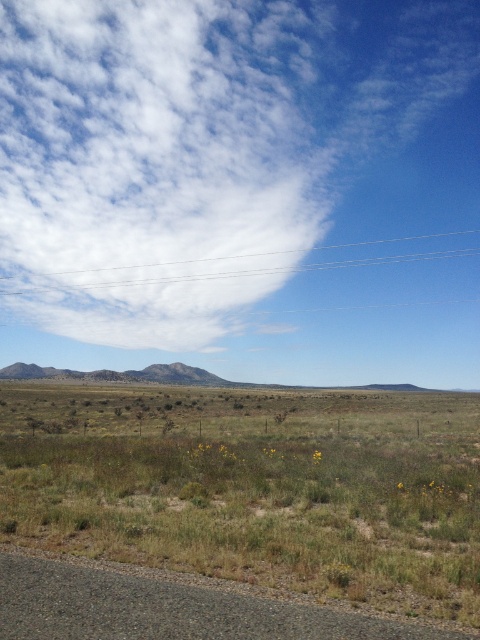
You are a photographer planning to capture a landscape photo that includes both the white fluffy cloud at upper center and the green grass at lower left. Considering their sizes in the image, which one will appear larger in your photo?

The white fluffy cloud at upper center will appear larger in the photo because it is much taller than the green grass at lower left.

You are standing in the middle of the open field and want to reach the white fluffy cloud at upper center. Considering the distance provided, is it feasible for you to walk there?

The distance between you and the white fluffy cloud at upper center is 460.99 feet, but clouds are located high in the sky and cannot be reached by walking on the ground, so it is not feasible to walk there.